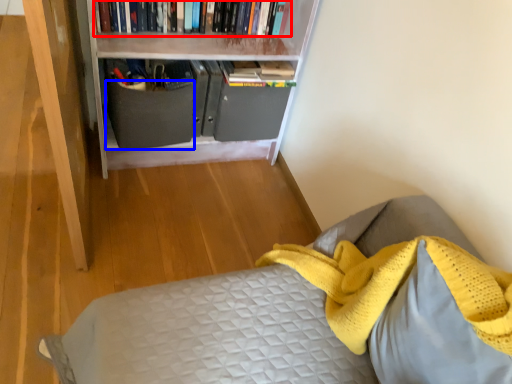
Question: Which point is further to the camera, book (highlighted by a red box) or drawer (highlighted by a blue box)?

Choices:
 (A) book
 (B) drawer

Answer: (B)